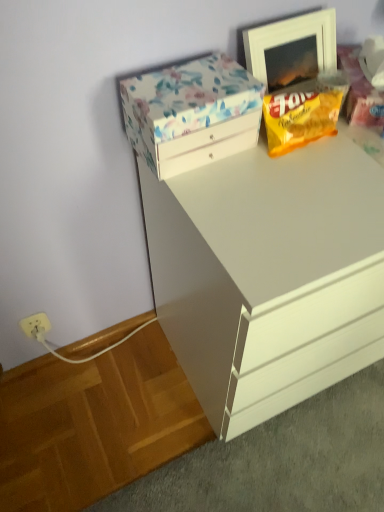
This screenshot has height=512, width=384. I want to click on vacant space to the right of floral-patterned cardboard box at upper left, so click(x=290, y=169).